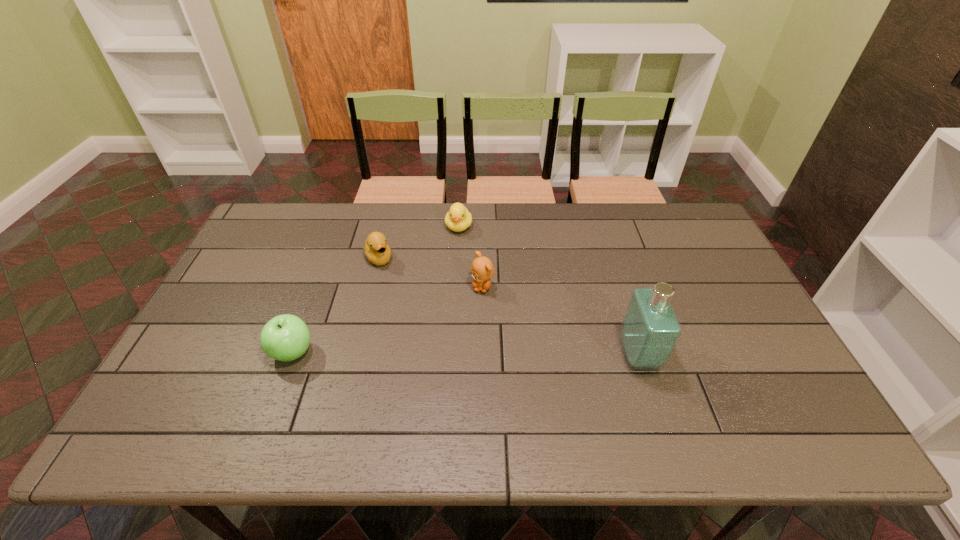
Locate an element on the screen. The image size is (960, 540). object located in the near edge section of the desktop is located at coordinates (650, 330).

You are a GUI agent. You are given a task and a screenshot of the screen. Output one action in this format:
    pyautogui.click(x=<x>, y=<y>)
    Task: Click on the free point at the far edge
    
    Given the screenshot: What is the action you would take?
    pyautogui.click(x=468, y=240)

This screenshot has height=540, width=960. I want to click on vacant region at the near edge of the desktop, so click(363, 404).

You are a GUI agent. You are given a task and a screenshot of the screen. Output one action in this format:
    pyautogui.click(x=<x>, y=<y>)
    Task: Click on the vacant space at the left edge of the desktop
    The width and height of the screenshot is (960, 540).
    Given the screenshot: What is the action you would take?
    pyautogui.click(x=246, y=348)

The height and width of the screenshot is (540, 960). Find the location of `free point at the right edge`. free point at the right edge is located at coordinates (703, 288).

Where is `vacant space at the near left corner of the desktop`? The image size is (960, 540). vacant space at the near left corner of the desktop is located at coordinates (174, 393).

This screenshot has height=540, width=960. In the image, there is a desktop. In order to click on vacant space at the far right corner in this screenshot , I will do `click(660, 220)`.

Where is `free point between the farther duckling and the teddy bear`? The image size is (960, 540). free point between the farther duckling and the teddy bear is located at coordinates (470, 257).

Find the location of a particular element. free spot between the leftmost object and the second farthest object is located at coordinates (335, 305).

The image size is (960, 540). What are the coordinates of `unoccupied area between the right duckling and the teddy bear` in the screenshot? It's located at [x=470, y=257].